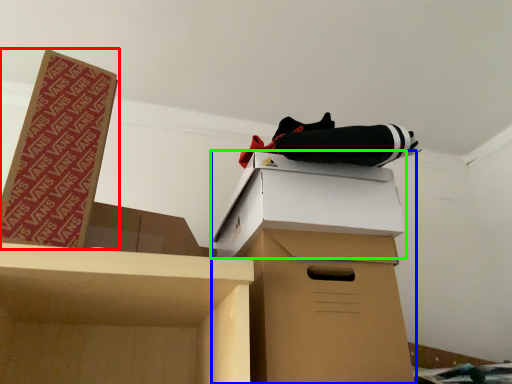
Question: Estimate the real-world distances between objects in this image. Which object is farther from box (highlighted by a red box), cardboard box (highlighted by a blue box) or box (highlighted by a green box)?

Choices:
 (A) cardboard box
 (B) box

Answer: (A)